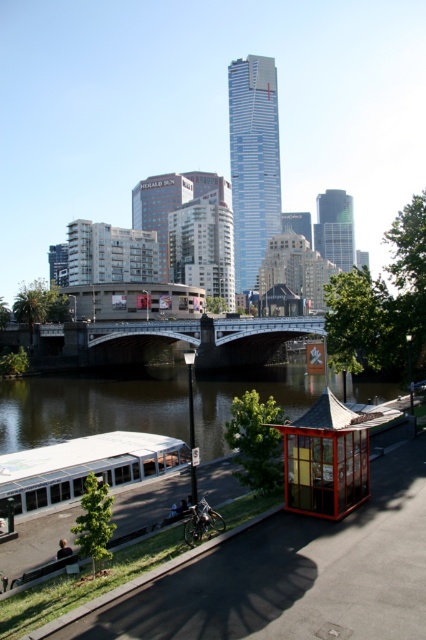
Question: Which of the following is the closest to the observer?

Choices:
 (A) (316, 476)
 (B) (146, 404)

Answer: (A)

Question: Which point is closer to the camera?

Choices:
 (A) (229, 320)
 (B) (11, 481)
 (C) (377, 417)

Answer: (C)

Question: Which object is positioned farthest from the metallic gray bridge at center?

Choices:
 (A) wooden bus stop at center
 (B) white matte boat at lower left
 (C) brown water at lower center

Answer: (A)

Question: Does brown water at lower center have a lesser width compared to white matte boat at lower left?

Choices:
 (A) no
 (B) yes

Answer: (A)

Question: Can you confirm if metallic gray bridge at center is wider than white matte boat at lower left?

Choices:
 (A) yes
 (B) no

Answer: (A)

Question: Is brown water at lower center bigger than white matte boat at lower left?

Choices:
 (A) yes
 (B) no

Answer: (A)